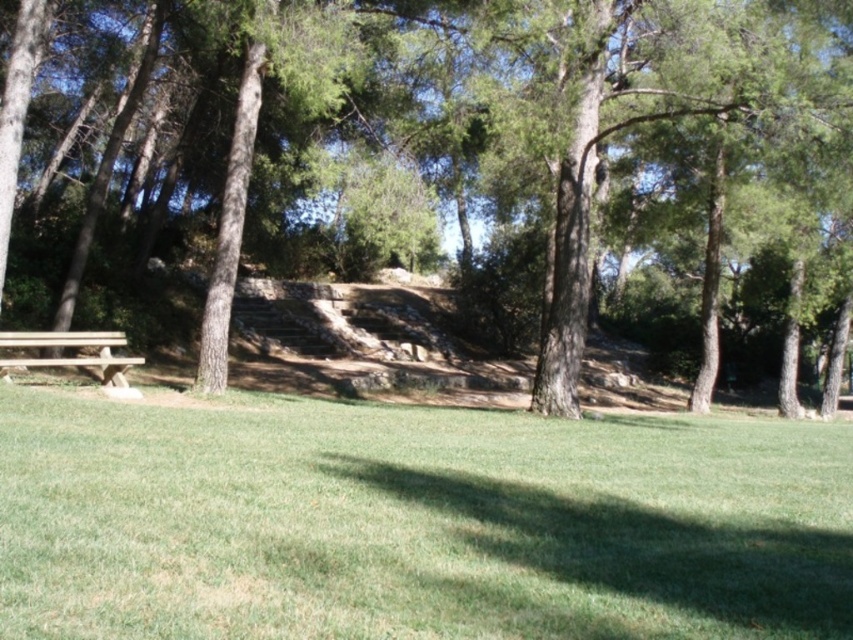
What do you see at coordinates (416, 524) in the screenshot? I see `green grass at lower center` at bounding box center [416, 524].

Who is shorter, green grass at lower center or wooden bench at lower left?

With less height is wooden bench at lower left.

The height and width of the screenshot is (640, 853). What do you see at coordinates (416, 524) in the screenshot?
I see `green grass at lower center` at bounding box center [416, 524].

You are a GUI agent. You are given a task and a screenshot of the screen. Output one action in this format:
    pyautogui.click(x=<x>, y=<y>)
    Task: Click on the green grass at lower center
    Image resolution: width=853 pixels, height=640 pixels.
    Given the screenshot: What is the action you would take?
    pyautogui.click(x=416, y=524)

Is point (54, 456) positioned before point (590, 168)?

Yes.

Measure the distance from green grass at lower center to brown textured tree at left.

green grass at lower center is 12.59 meters from brown textured tree at left.

The height and width of the screenshot is (640, 853). Describe the element at coordinates (416, 524) in the screenshot. I see `green grass at lower center` at that location.

At what (x,y) coordinates should I click in order to perform the action: click on green grass at lower center. Please return your answer as a coordinate pair (x, y). The height and width of the screenshot is (640, 853). Looking at the image, I should click on (416, 524).

Does brown textured tree at left come behind wooden bench at lower left?

Yes, brown textured tree at left is behind wooden bench at lower left.

Between brown textured tree at left and wooden bench at lower left, which one is positioned lower?

Positioned lower is wooden bench at lower left.

Find the location of a particular element. This screenshot has width=853, height=640. brown textured tree at left is located at coordinates (531, 148).

You are a GUI agent. You are given a task and a screenshot of the screen. Output one action in this format:
    pyautogui.click(x=<x>, y=<y>)
    Task: Click on the brown textured tree at left
    
    Given the screenshot: What is the action you would take?
    pyautogui.click(x=531, y=148)